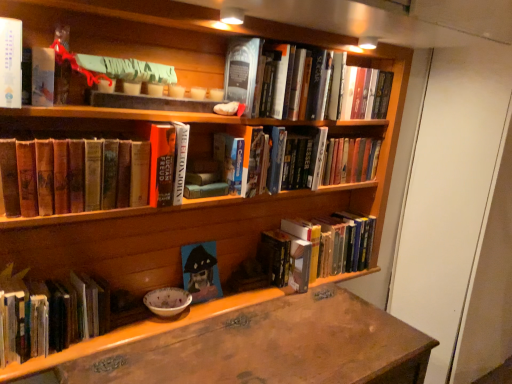
Question: Considering the positions of brown leather book at lower left, which is counted as the second book, starting from the left, and hardcover book at upper center, marked as the 6th book in a left-to-right arrangement, in the image, is brown leather book at lower left, which is counted as the second book, starting from the left, bigger or smaller than hardcover book at upper center, marked as the 6th book in a left-to-right arrangement,?

Choices:
 (A) small
 (B) big

Answer: (A)

Question: Visually, is brown leather book at lower left, the 6th book from the right, positioned to the left or to the right of hardcover book at upper center, the 2th book from the right?

Choices:
 (A) right
 (B) left

Answer: (B)

Question: Estimate the real-world distances between objects in this image. Which object is farther from the green paper sign at upper center, which appears as the fifth book when viewed from the right?

Choices:
 (A) hardcover book at lower right, which is the first book from right to left
 (B) hardcover book at upper center, the 2th book from the right
 (C) hardcover book at center, marked as the 4th book in a right-to-left arrangement
 (D) wooden desk at lower center
 (E) matte blue canvas painting at center, the third book positioned from the right

Answer: (A)

Question: Which object is the closest to the green paper sign at upper center, the third book positioned from the left?

Choices:
 (A) hardcover book at upper center, the 2th book from the right
 (B) matte blue canvas painting at center, the third book positioned from the right
 (C) brown leather book at lower left, the 6th book from the right
 (D) hardcover book at lower left, which is the 7th book from right to left
 (E) wooden desk at lower center

Answer: (C)